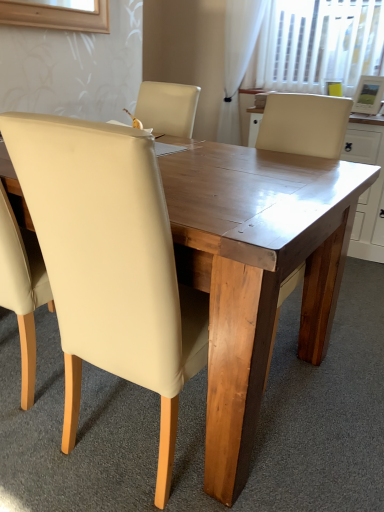
Question: From a real-world perspective, is beige leather chair at center positioned over white sheer curtain at upper right based on gravity?

Choices:
 (A) yes
 (B) no

Answer: (B)

Question: Can you confirm if beige leather chair at center is thinner than white sheer curtain at upper right?

Choices:
 (A) no
 (B) yes

Answer: (A)

Question: From a real-world perspective, is beige leather chair at center located beneath white sheer curtain at upper right?

Choices:
 (A) yes
 (B) no

Answer: (A)

Question: Does beige leather chair at center have a greater width compared to white sheer curtain at upper right?

Choices:
 (A) no
 (B) yes

Answer: (B)

Question: Is beige leather chair at center positioned far away from white sheer curtain at upper right?

Choices:
 (A) yes
 (B) no

Answer: (A)

Question: Can you confirm if beige leather chair at center is bigger than white sheer curtain at upper right?

Choices:
 (A) no
 (B) yes

Answer: (B)

Question: Does white sheer curtain at upper right have a greater height compared to beige leather chair at center?

Choices:
 (A) yes
 (B) no

Answer: (A)

Question: Considering the relative positions of white sheer curtain at upper right and beige leather chair at center in the image provided, is white sheer curtain at upper right to the left of beige leather chair at center from the viewer's perspective?

Choices:
 (A) no
 (B) yes

Answer: (A)

Question: Is white sheer curtain at upper right thinner than beige leather chair at center?

Choices:
 (A) no
 (B) yes

Answer: (B)

Question: Considering the relative sizes of white sheer curtain at upper right and beige leather chair at center in the image provided, is white sheer curtain at upper right wider than beige leather chair at center?

Choices:
 (A) no
 (B) yes

Answer: (A)

Question: Does white sheer curtain at upper right turn towards beige leather chair at center?

Choices:
 (A) no
 (B) yes

Answer: (A)

Question: Are white sheer curtain at upper right and beige leather chair at center far apart?

Choices:
 (A) no
 (B) yes

Answer: (B)

Question: Is beige leather chair at center spatially inside white sheer curtain at upper right, or outside of it?

Choices:
 (A) inside
 (B) outside

Answer: (B)